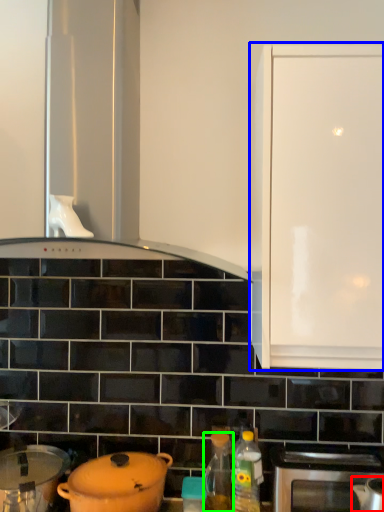
Question: Estimate the real-world distances between objects in this image. Which object is closer to kitchen appliance (highlighted by a red box), cabinetry (highlighted by a blue box) or bottle (highlighted by a green box)?

Choices:
 (A) cabinetry
 (B) bottle

Answer: (B)